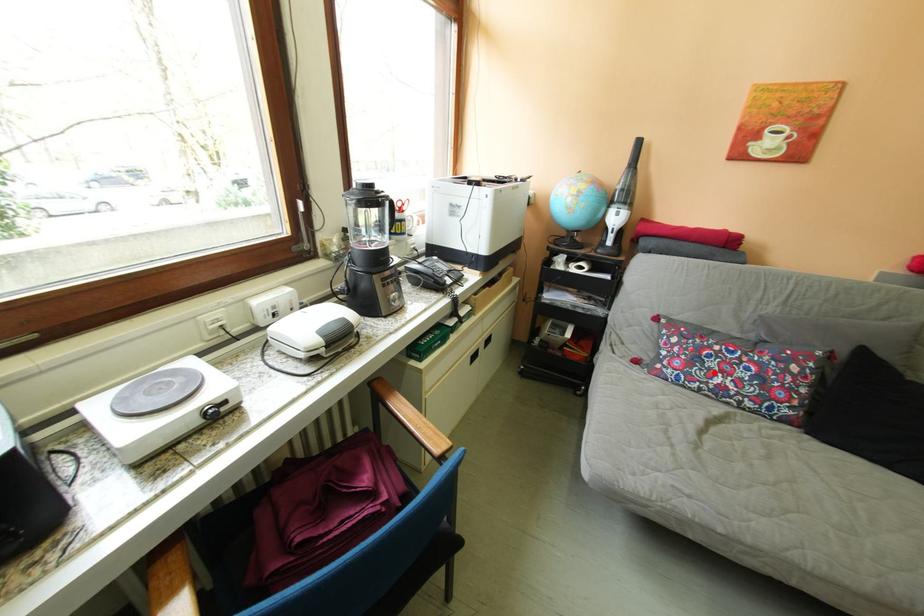
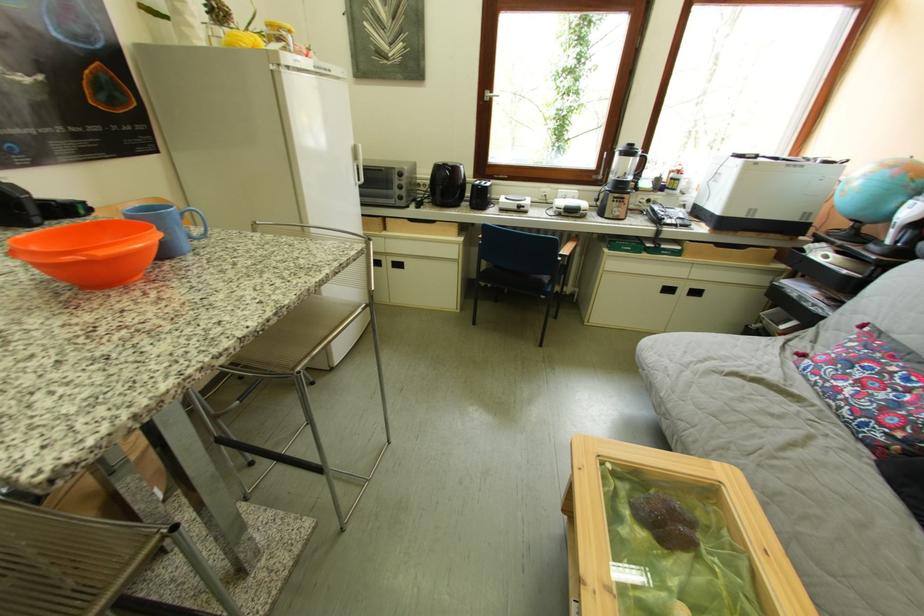
Find the pixel in the second image that matches the highlighted location in the first image.

(849, 374)